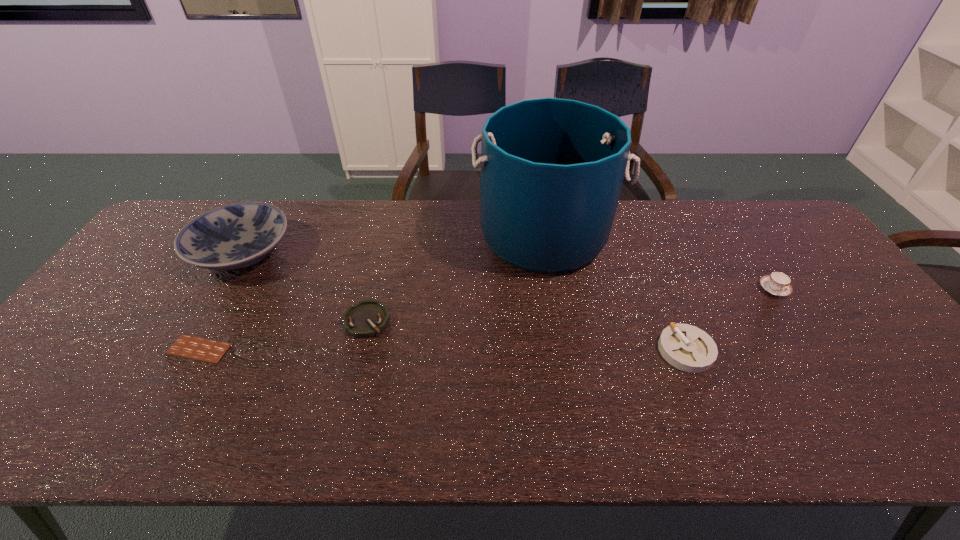
Identify the location of bucket. (552, 169).

Locate an element on the screen. the tallest object is located at coordinates tap(552, 169).

The width and height of the screenshot is (960, 540). Find the location of `plate`. plate is located at coordinates [x=234, y=236].

You are a GUI agent. You are given a task and a screenshot of the screen. Output one action in this format:
    pyautogui.click(x=<x>, y=<y>)
    Task: Click on the fourth shortest object
    
    Given the screenshot: What is the action you would take?
    pyautogui.click(x=777, y=283)

Locate an element on the screen. This screenshot has width=960, height=540. the rightmost object is located at coordinates (777, 283).

You are a GUI agent. You are given a task and a screenshot of the screen. Output one action in this format:
    pyautogui.click(x=<x>, y=<y>)
    Task: Click on the taller ashtray
    Image resolution: width=960 pixels, height=540 pixels.
    Given the screenshot: What is the action you would take?
    (x=688, y=348)

Identify the location of the fourth tallest object. (688, 348).

Locate an element on the screen. the fifth tallest object is located at coordinates (367, 318).

Find the location of a particular element. The height and width of the screenshot is (540, 960). the shorter ashtray is located at coordinates (367, 318).

At what (x,y) coordinates should I click in order to perform the action: click on the shortest object. Please return your answer as a coordinate pair (x, y). Image resolution: width=960 pixels, height=540 pixels. Looking at the image, I should click on (207, 350).